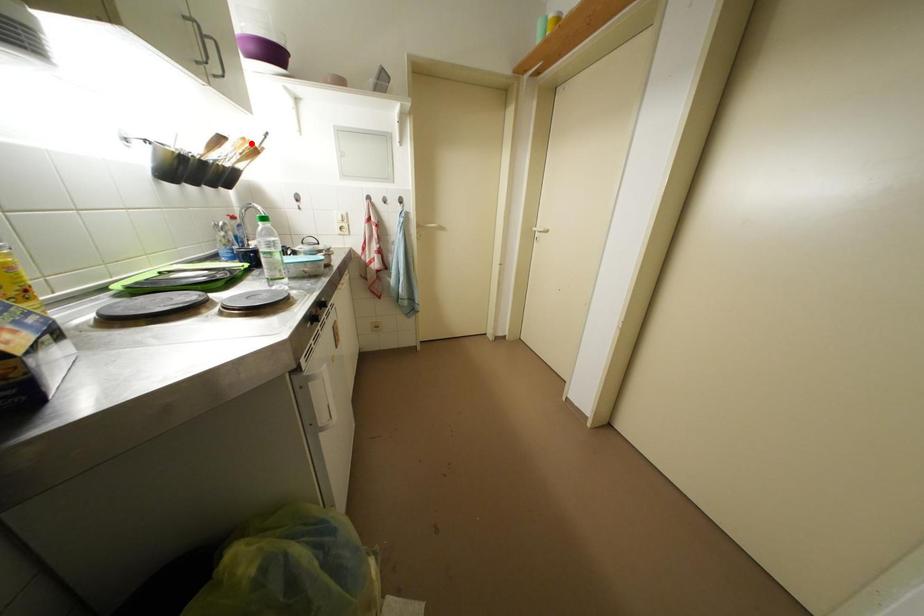
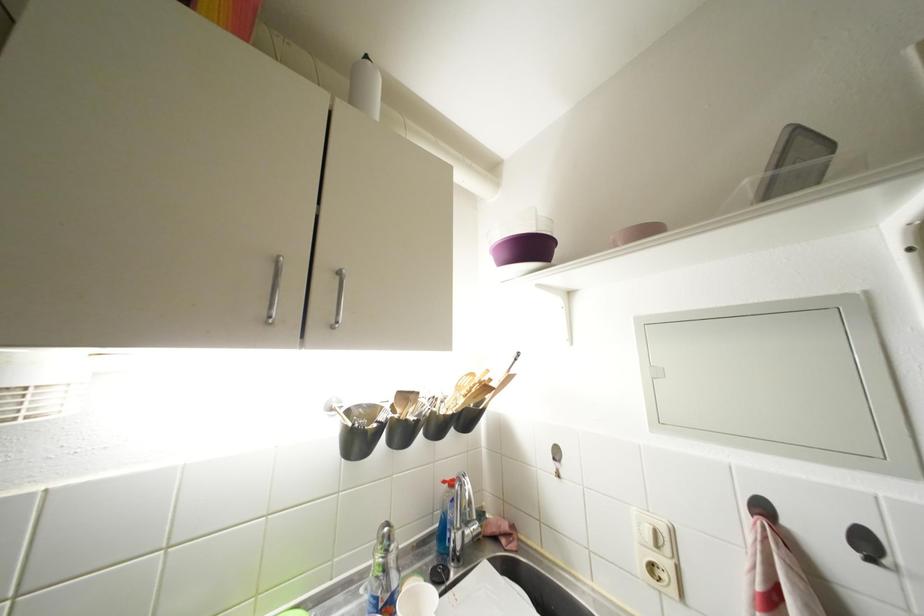
Where in the second image is the point corresponding to the highlighted location from the first image?

(479, 379)